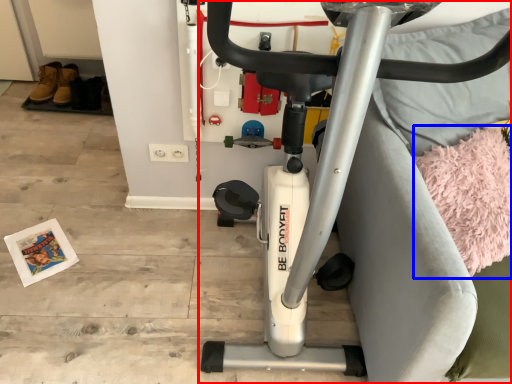
Question: Which object appears closest to the camera in this image, stationary bicycle (highlighted by a red box) or yoga mat (highlighted by a blue box)?

Choices:
 (A) stationary bicycle
 (B) yoga mat

Answer: (A)